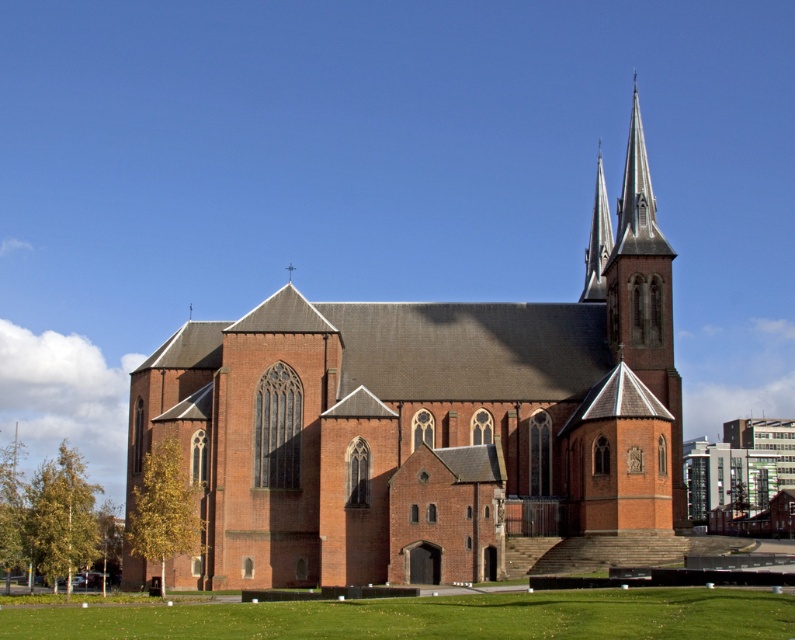
You are standing in front of the red brick church at center and want to take a photo of the red brick church steeple at upper right. Which object should you focus on first if you want to include both in the frame without zooming in?

You should focus on the red brick church at center first because it is wider than the red brick church steeple at upper right, so it will occupy more space in the frame and ensure both are included without zooming in.

You are standing at a certain distance from the red brick church at center. If you want to take a photo of the church without any distortion, considering the camera lens you have can capture a clear image up to 70 meters away, will you be able to take a clear photo?

The red brick church at center and camera are 69.73 meters apart from each other. Since the distance is within the camera lens range of 70 meters, you can take a clear photo without distortion.

You are standing at the center of a square in front of the church. If you walk straight ahead, will you reach the red brick church at center?

Yes, because the red brick church at center is located directly ahead at point [425,422], so walking straight ahead from the center of the square will lead you directly to it.